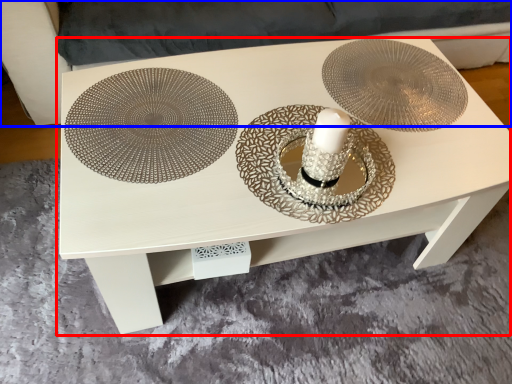
Question: Among these objects, which one is nearest to the camera, table (highlighted by a red box) or couch (highlighted by a blue box)?

Choices:
 (A) table
 (B) couch

Answer: (A)